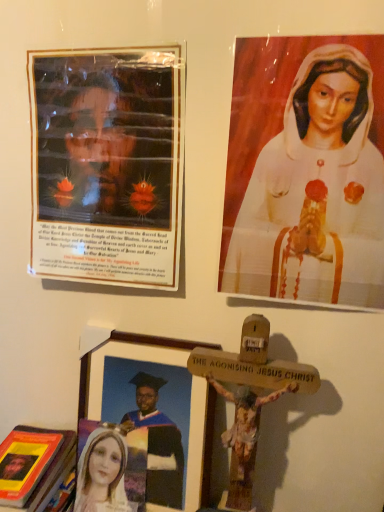
Question: Can you confirm if hardcover book at lower left is smaller than matte plastic poster at upper left, marked as the 2th picture frame in a bottom-to-top arrangement?

Choices:
 (A) no
 (B) yes

Answer: (A)

Question: From a real-world perspective, is hardcover book at lower left located higher than matte plastic poster at upper left, the first picture frame from the top?

Choices:
 (A) no
 (B) yes

Answer: (A)

Question: Can you confirm if hardcover book at lower left is bigger than matte plastic poster at upper left, the first picture frame from the top?

Choices:
 (A) yes
 (B) no

Answer: (A)

Question: Is there a large distance between hardcover book at lower left and matte plastic poster at upper left, the first picture frame from the top?

Choices:
 (A) no
 (B) yes

Answer: (A)

Question: From the image's perspective, is hardcover book at lower left over matte plastic poster at upper left, marked as the 2th picture frame in a bottom-to-top arrangement?

Choices:
 (A) yes
 (B) no

Answer: (B)

Question: From a real-world perspective, is wooden picture frame at lower center, the second picture frame viewed from the top, physically located above or below white glossy statue at upper right?

Choices:
 (A) below
 (B) above

Answer: (A)

Question: Based on their positions, is wooden picture frame at lower center, the second picture frame viewed from the top, located to the left or right of white glossy statue at upper right?

Choices:
 (A) right
 (B) left

Answer: (B)

Question: From the image's perspective, is wooden picture frame at lower center, the second picture frame viewed from the top, positioned above or below white glossy statue at upper right?

Choices:
 (A) below
 (B) above

Answer: (A)

Question: Considering the positions of point (167, 352) and point (235, 251), is point (167, 352) closer or farther from the camera than point (235, 251)?

Choices:
 (A) farther
 (B) closer

Answer: (A)

Question: Looking at the image, does matte plastic poster at upper left, marked as the 2th picture frame in a bottom-to-top arrangement, seem bigger or smaller compared to hardcover book at lower left?

Choices:
 (A) big
 (B) small

Answer: (B)

Question: From the image's perspective, is matte plastic poster at upper left, marked as the 2th picture frame in a bottom-to-top arrangement, above or below hardcover book at lower left?

Choices:
 (A) below
 (B) above

Answer: (B)

Question: Which is correct: matte plastic poster at upper left, marked as the 2th picture frame in a bottom-to-top arrangement, is inside hardcover book at lower left, or outside of it?

Choices:
 (A) inside
 (B) outside

Answer: (B)

Question: Is point (43, 110) closer or farther from the camera than point (59, 465)?

Choices:
 (A) farther
 (B) closer

Answer: (B)

Question: Considering the relative positions of matte plastic poster at upper left, the first picture frame from the top, and white glossy statue at upper right in the image provided, is matte plastic poster at upper left, the first picture frame from the top, to the left or to the right of white glossy statue at upper right?

Choices:
 (A) left
 (B) right

Answer: (A)

Question: From a real-world perspective, is matte plastic poster at upper left, the first picture frame from the top, above or below white glossy statue at upper right?

Choices:
 (A) below
 (B) above

Answer: (A)